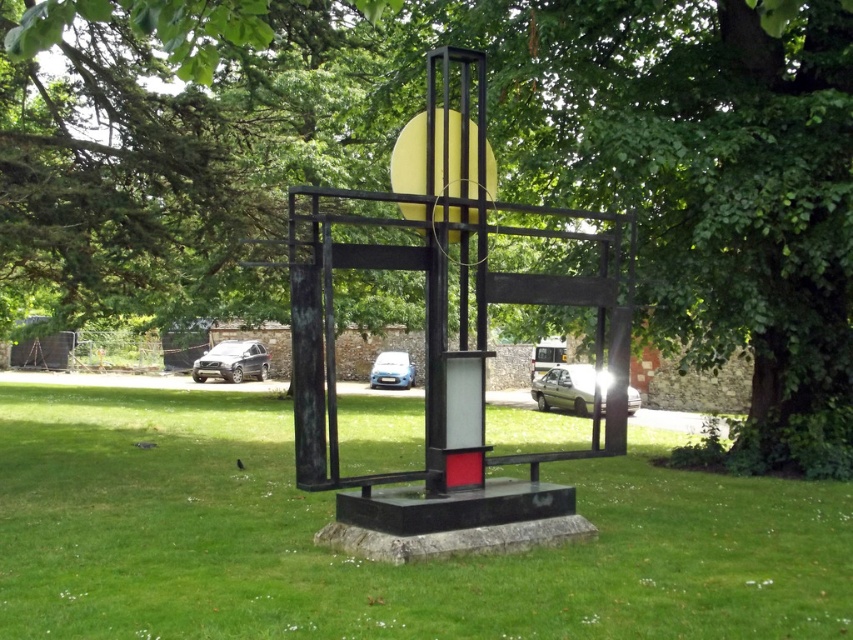
Is green leafy tree at center shorter than green grass at center?

In fact, green leafy tree at center may be taller than green grass at center.

Is point (4, 218) closer to viewer compared to point (503, 589)?

That is False.

I want to click on green leafy tree at center, so click(x=604, y=148).